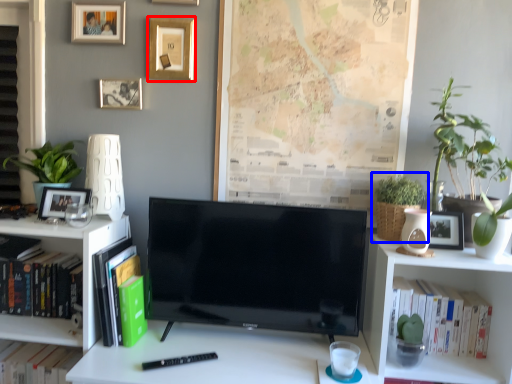
Question: Which object appears farthest to the camera in this image, picture frame (highlighted by a red box) or houseplant (highlighted by a blue box)?

Choices:
 (A) picture frame
 (B) houseplant

Answer: (A)